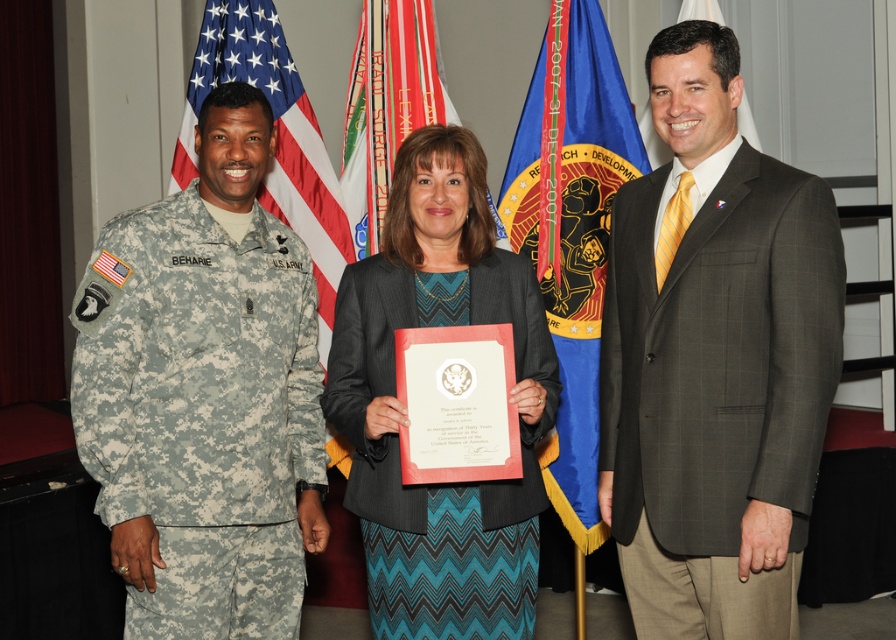
Looking at this image, you are attending this formal event and need to take a photo with the blue fabric flag at center and the camouflage fabric uniform at center. Since you want the flag to be more prominent in the photo than the uniform, which one should you position closer to the camera?

The blue fabric flag at center is larger than the camouflage fabric uniform at center. To make the flag more prominent in the photo, you should position the blue fabric flag at center closer to the camera since its larger size will already make it stand out more, and moving it closer would enhance its prominence compared to the uniform.

Based on the scene description, can you determine the spatial relationship between the dark gray textured suit at right and the camouflage fabric uniform at left?

The dark gray textured suit at right is to the right of the camouflage fabric uniform at left.